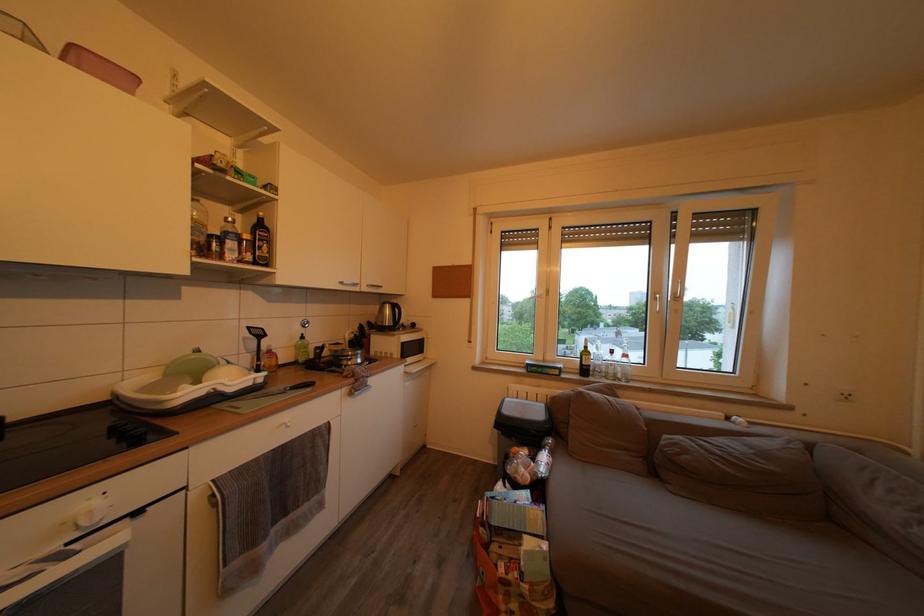
Locate an element on the screen. black spatula is located at coordinates (257, 344).